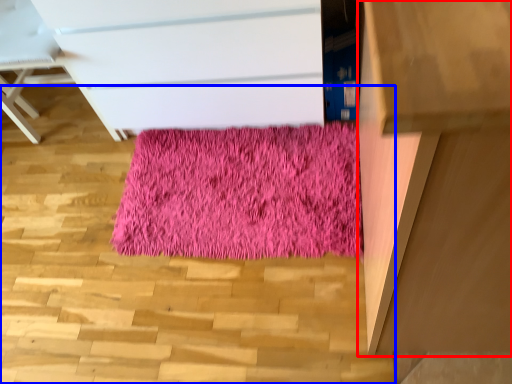
Question: Which of the following is the farthest to the observer, furniture (highlighted by a red box) or stairwell (highlighted by a blue box)?

Choices:
 (A) furniture
 (B) stairwell

Answer: (A)